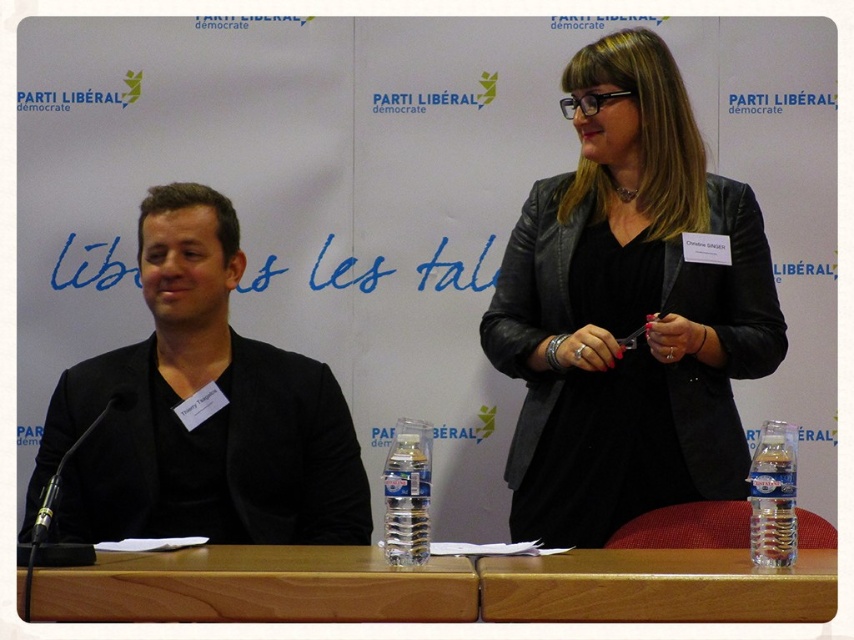
You are a photographer at the event and want to capture both the black leather jacket at upper right and the clear plastic bottle at lower right in a single frame. Given their sizes, which object should you focus on to ensure both are clearly visible?

The black leather jacket at upper right is larger than the clear plastic bottle at lower right, so focusing on the larger object while adjusting the camera angle to include the smaller one would work best.